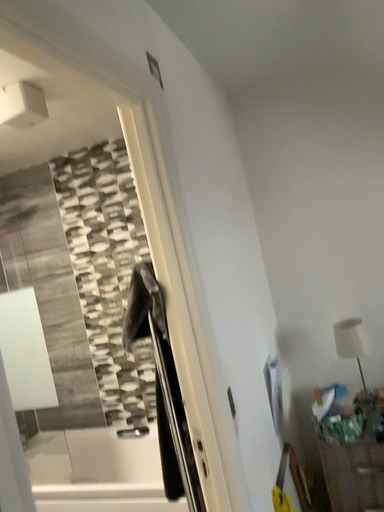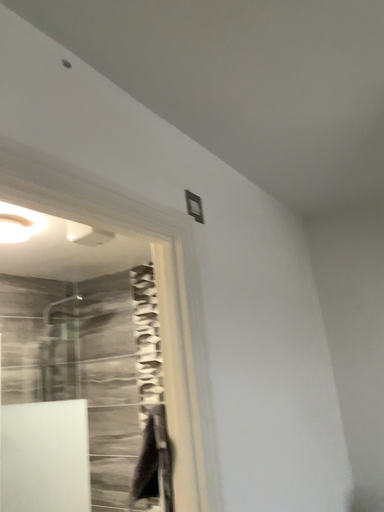
Question: How did the camera likely rotate when shooting the video?

Choices:
 (A) rotated left
 (B) rotated right

Answer: (A)